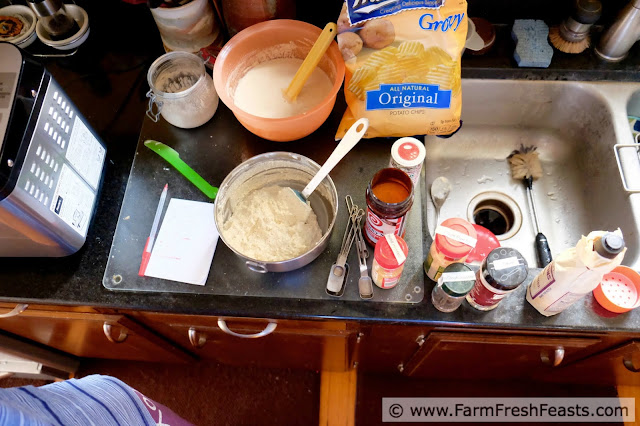
This screenshot has height=426, width=640. Find the location of `white spoon handle`. white spoon handle is located at coordinates (337, 152).